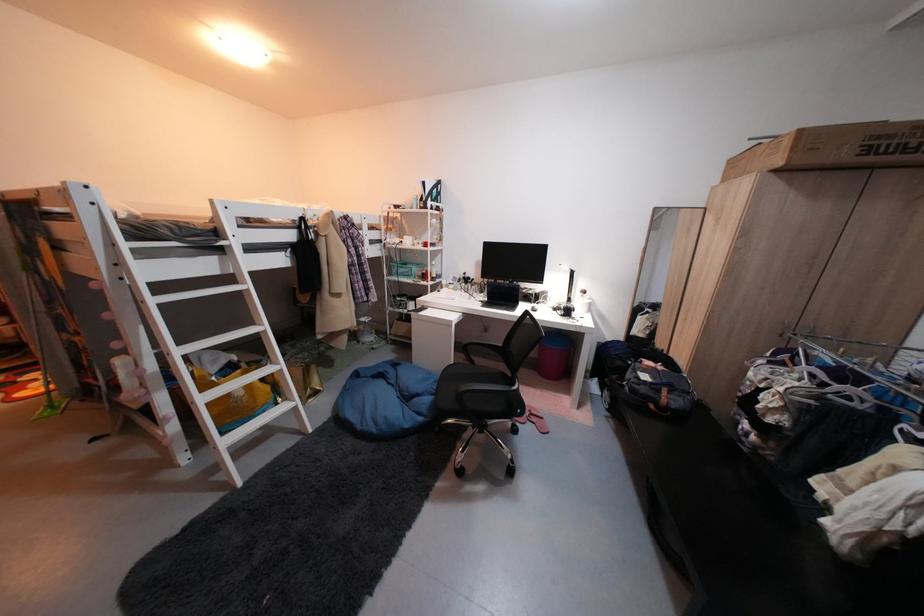
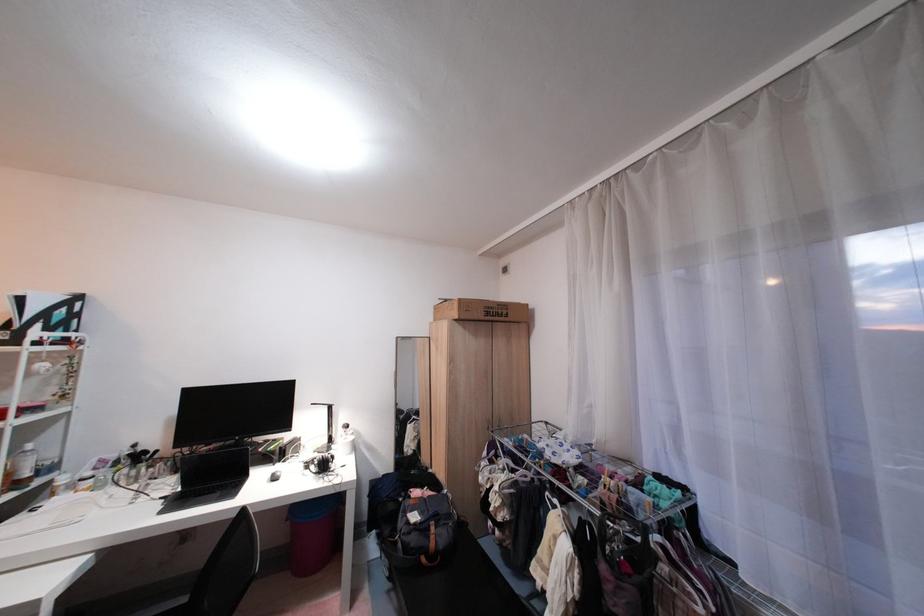
The point at (492, 302) is marked in the first image. Where is the corresponding point in the second image?

(172, 500)